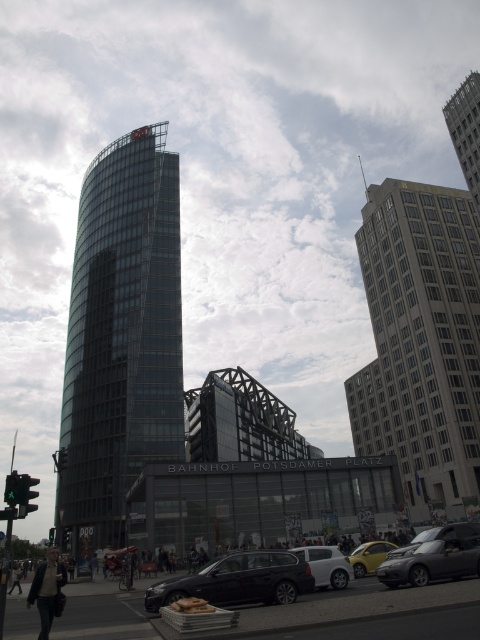
Is matte black car at center thinner than shiny black car at lower center?

In fact, matte black car at center might be wider than shiny black car at lower center.

Is matte black car at center shorter than shiny black car at lower center?

No, matte black car at center is not shorter than shiny black car at lower center.

Where is `matte black car at center`? This screenshot has width=480, height=640. matte black car at center is located at coordinates (233, 579).

Is shiny black car at lower center wider than green glass traffic light at center?

Incorrect, shiny black car at lower center's width does not surpass green glass traffic light at center's.

Who is more distant from viewer, (260, 572) or (48, 534)?

The point (48, 534) is behind.

At what (x,y) coordinates should I click in order to perform the action: click on shiny black car at lower center. Please return your answer as a coordinate pair (x, y). Looking at the image, I should click on (239, 580).

In the scene shown: Between matte black car at center and green glass traffic light at center, which one appears on the right side from the viewer's perspective?

From the viewer's perspective, matte black car at center appears more on the right side.

Locate an element on the screen. matte black car at center is located at coordinates (233, 579).

Identify the location of matte black car at center. The image size is (480, 640). (233, 579).